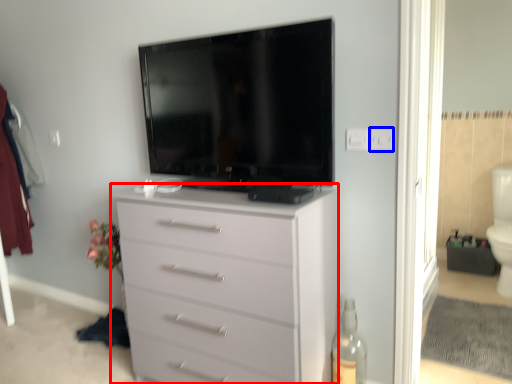
Question: Which object appears closest to the camera in this image, chest of drawers (highlighted by a red box) or electric outlet (highlighted by a blue box)?

Choices:
 (A) chest of drawers
 (B) electric outlet

Answer: (A)